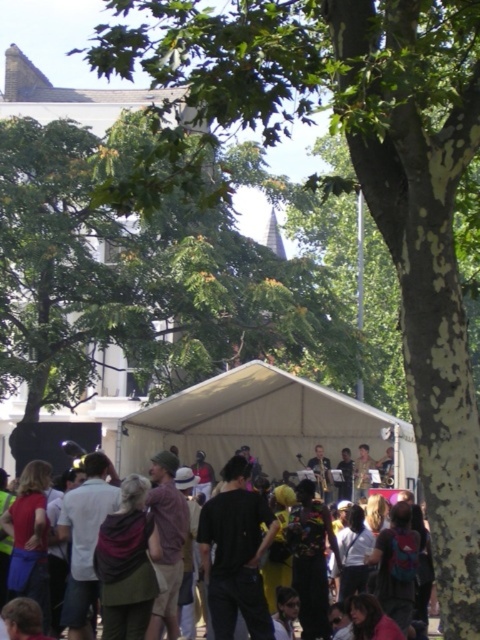
Question: Does green leafy tree at upper center have a larger size compared to black fabric tent at center?

Choices:
 (A) no
 (B) yes

Answer: (B)

Question: Does green leafy tree at upper center have a larger size compared to white fabric canopy at center?

Choices:
 (A) yes
 (B) no

Answer: (A)

Question: Considering the real-world distances, which object is closest to the green leafy tree at upper center?

Choices:
 (A) white fabric canopy at center
 (B) black fabric tent at center

Answer: (A)

Question: Which of the following is the farthest from the observer?

Choices:
 (A) green leafy tree at upper center
 (B) black fabric tent at center

Answer: (B)

Question: Can you confirm if green leafy tree at upper center is thinner than white fabric canopy at center?

Choices:
 (A) no
 (B) yes

Answer: (A)

Question: Which object is farther from the camera taking this photo?

Choices:
 (A) black fabric tent at center
 (B) white fabric canopy at center

Answer: (B)